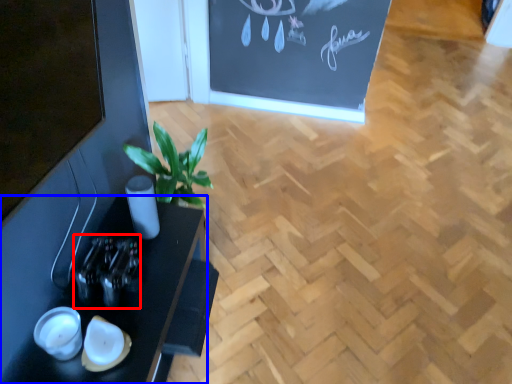
Question: Which object is closer to the camera taking this photo, bottle (highlighted by a red box) or table (highlighted by a blue box)?

Choices:
 (A) bottle
 (B) table

Answer: (B)